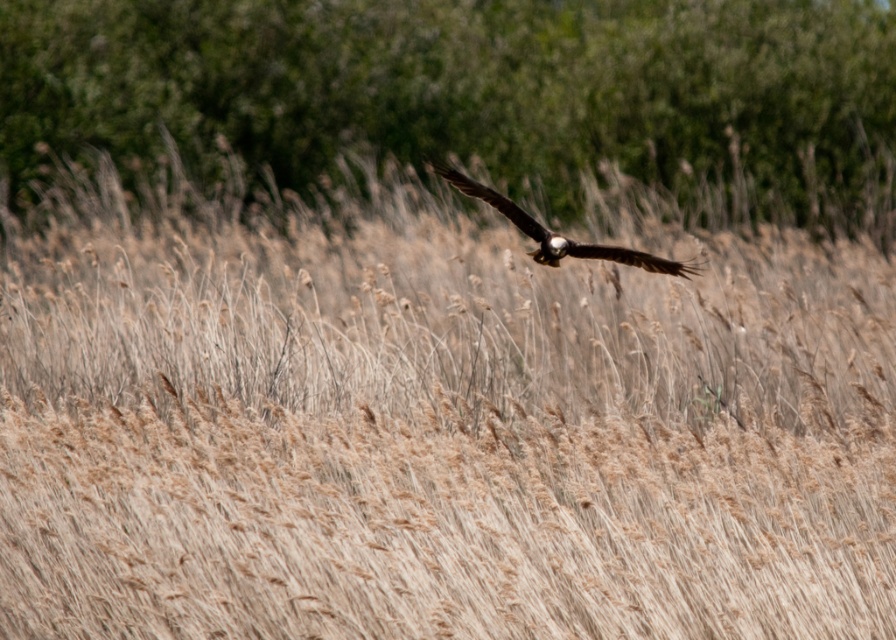
Is green leafy tree at upper center to the right of brown feathered eagle at center from the viewer's perspective?

No, green leafy tree at upper center is not to the right of brown feathered eagle at center.

Does green leafy tree at upper center have a greater width compared to brown feathered eagle at center?

Yes, green leafy tree at upper center is wider than brown feathered eagle at center.

Is point (838, 179) closer to viewer compared to point (653, 256)?

That is False.

In order to click on green leafy tree at upper center in this screenshot , I will do `click(472, 93)`.